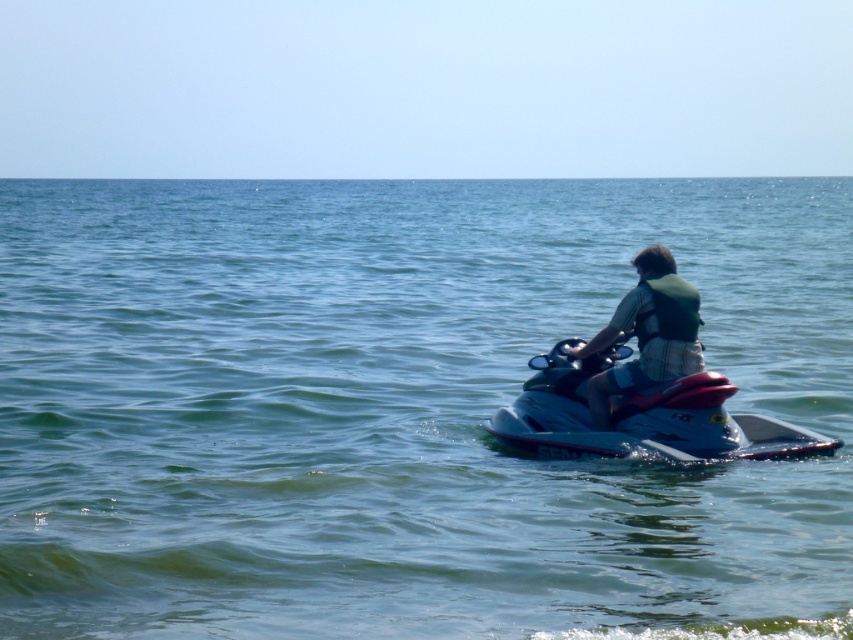
Which is more to the left, metallic blue jet ski at center or green fabric life jacket at center?

Positioned to the left is metallic blue jet ski at center.

Does metallic blue jet ski at center come in front of green fabric life jacket at center?

That is True.

Between point (566, 349) and point (653, 292), which one is positioned behind?

Point (566, 349)

Find the location of a particular element. metallic blue jet ski at center is located at coordinates (641, 417).

Who is positioned more to the right, green fabric life vest at center or green fabric life jacket at center?

From the viewer's perspective, green fabric life jacket at center appears more on the right side.

Is green fabric life vest at center bigger than green fabric life jacket at center?

Yes, green fabric life vest at center is bigger than green fabric life jacket at center.

This screenshot has width=853, height=640. What do you see at coordinates (647, 333) in the screenshot? I see `green fabric life vest at center` at bounding box center [647, 333].

The width and height of the screenshot is (853, 640). Find the location of `green fabric life vest at center`. green fabric life vest at center is located at coordinates (647, 333).

Between clear blue water at center and metallic blue jet ski at center, which one appears on the right side from the viewer's perspective?

metallic blue jet ski at center

Find the location of `clear blue water at center`. clear blue water at center is located at coordinates (402, 410).

Between point (787, 344) and point (717, 397), which one is positioned in front?

Positioned in front is point (717, 397).

The image size is (853, 640). I want to click on clear blue water at center, so click(x=402, y=410).